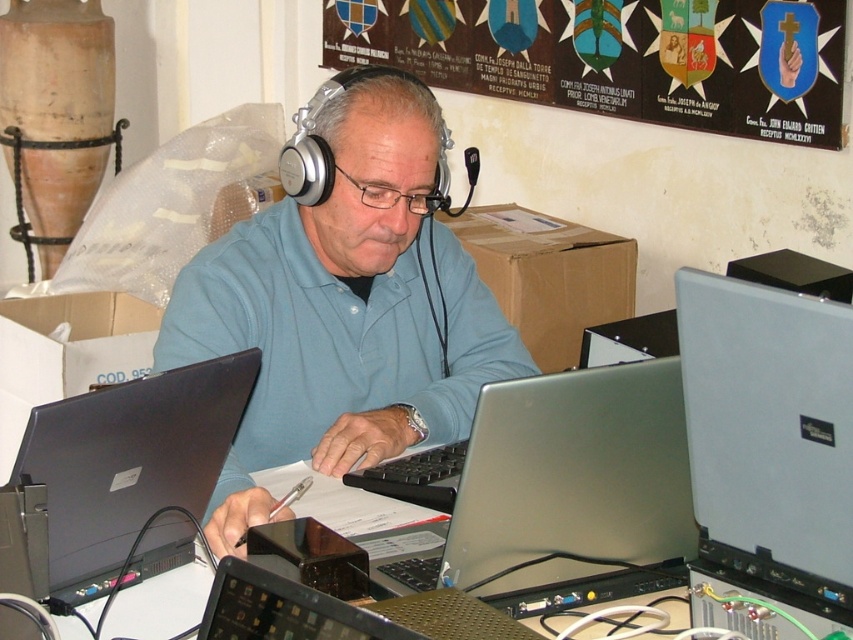
You are organizing a photoshoot and need to ensure proper lighting. The matte blue shirt at center and the black glossy laptop at center are both in the frame. According to the scene, which object is positioned to the left of the other?

The matte blue shirt at center is to the left of the black glossy laptop at center.

You are a delivery robot trying to navigate to a package located at point (795, 618). There is an obstacle at point (433, 392). Can you safely move around the obstacle to reach the package?

Point (433, 392) is further to the viewer than point (795, 618). This means the obstacle at point (433, 392) is closer to you, so you can navigate around it to reach the package at point (795, 618).

You are a delivery person who needs to place a package on the desk without disturbing the man or his equipment. The package is 10 cm thick. Can you place it between the matte blue shirt at center and the black glossy laptop at center?

The matte blue shirt at center is further to the viewer than the black glossy laptop at center, so there is no space between them for the package. You should choose another location on the desk to place the package.